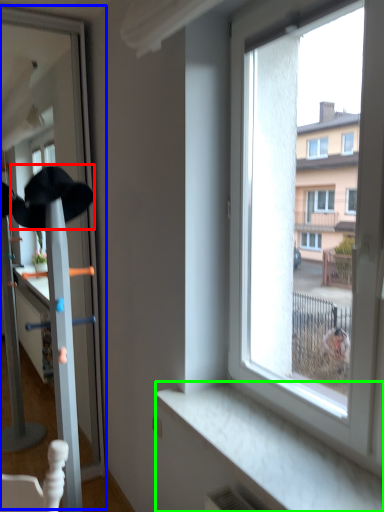
Question: Which is farther away from baseball hat (highlighted by a red box)? screen door (highlighted by a blue box) or window sill (highlighted by a green box)?

Choices:
 (A) screen door
 (B) window sill

Answer: (B)